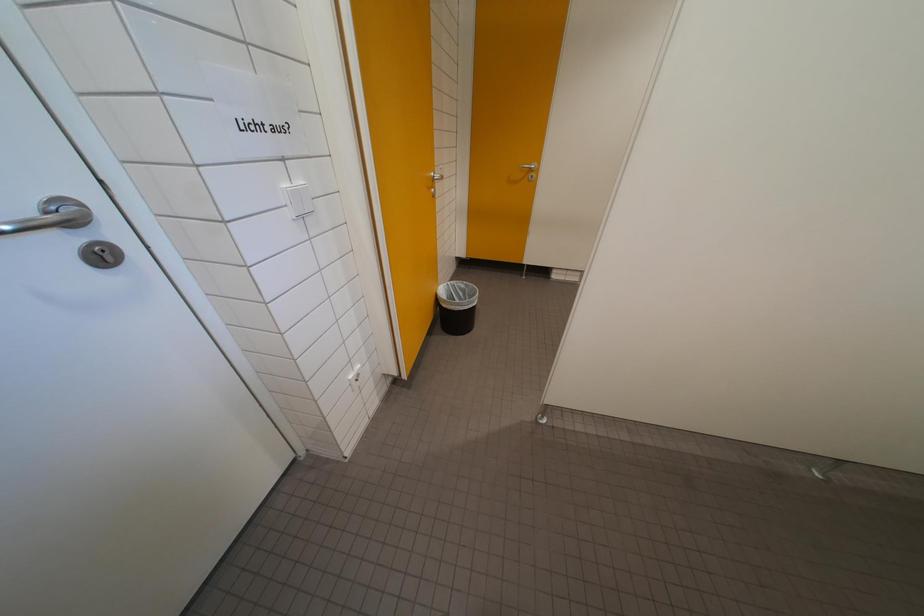
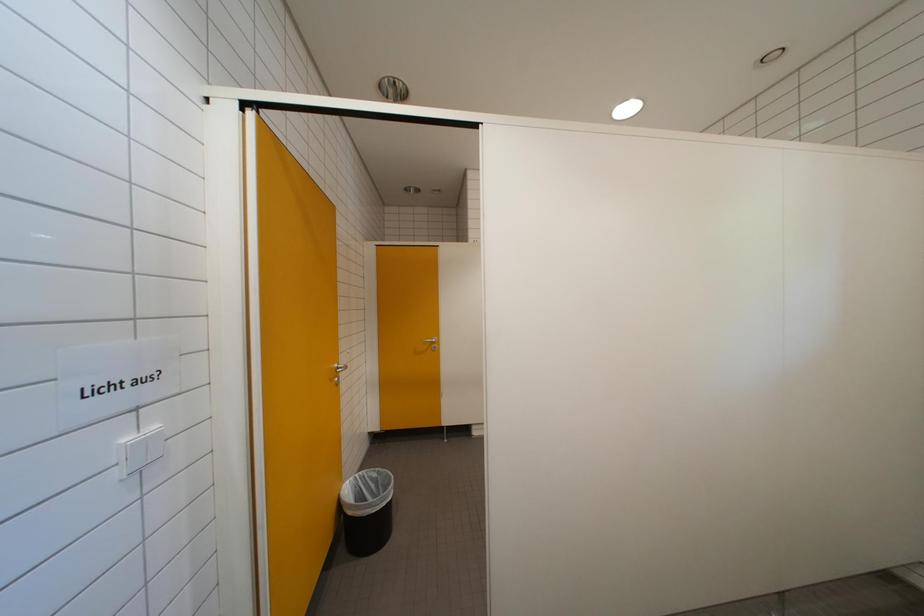
Based on the photo, the first image is from the beginning of the video and the second image is from the end. How did the camera likely rotate when shooting the video?

The rotation direction of the camera is right-up.